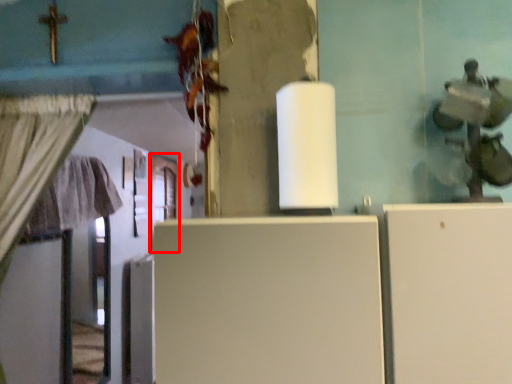
Question: In this image, where is door (annotated by the red box) located relative to fridge?

Choices:
 (A) right
 (B) left

Answer: (B)